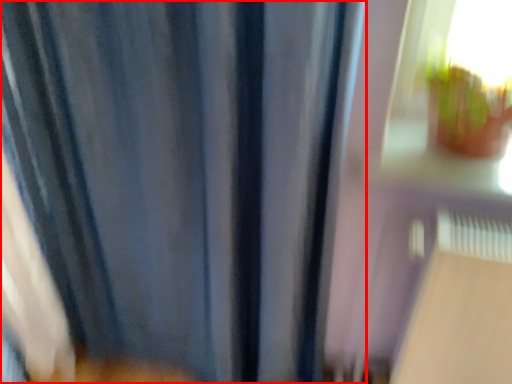
Question: From the image's perspective, what is the correct spatial relationship of curtain (annotated by the red box) in relation to train window?

Choices:
 (A) above
 (B) below

Answer: (B)